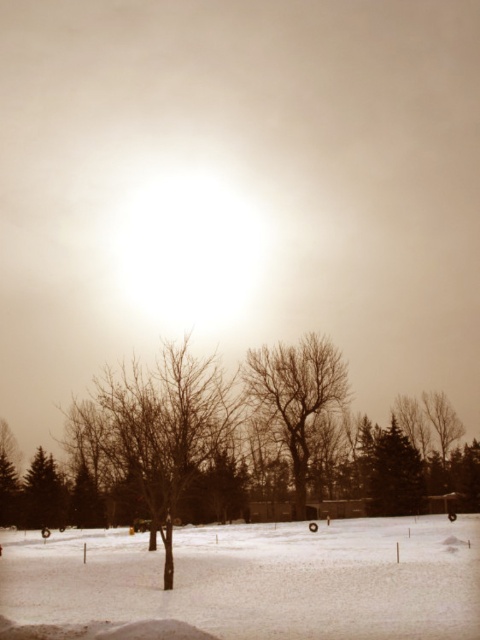
You are standing in the winter landscape and want to take a photo. You notice two points marked in the scene. Which point, point (x=158, y=614) or point (x=259, y=392), is closer to your camera lens?

Point (x=158, y=614) is closer to the camera than point (x=259, y=392).

You are an artist sketching the winter scene. You notice the bare branches at center and the green textured evergreen at center. Which object should you draw first to ensure proper layering in your sketch?

You should draw the green textured evergreen at center first because the bare branches at center are in front of it, so the branches will be layered over the evergreen in the sketch.